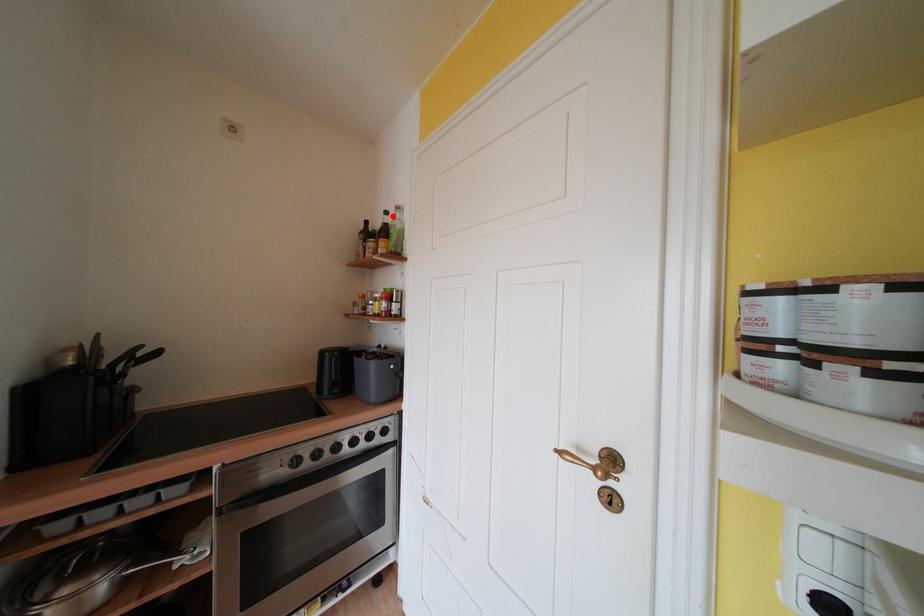
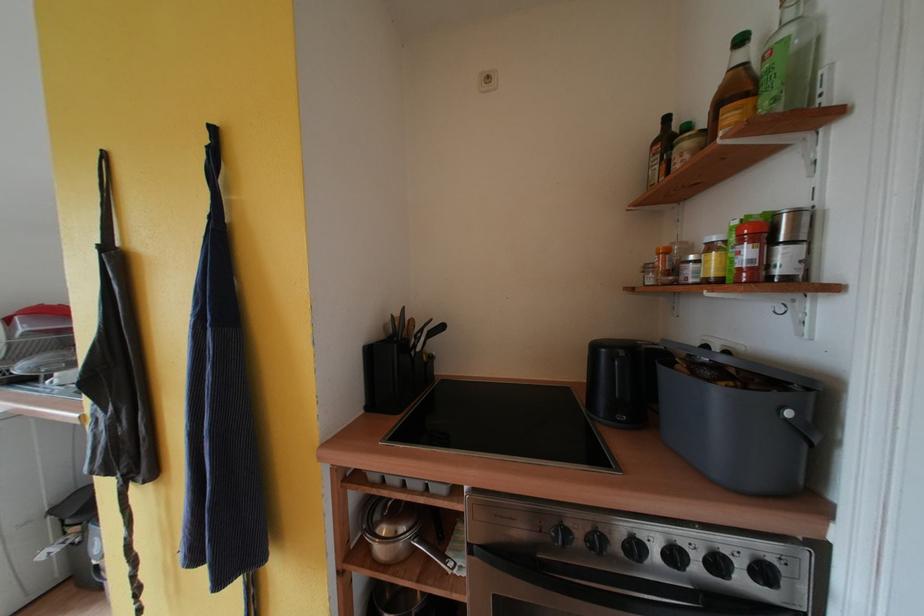
Where in the second image is the point corresponding to the highlighted location from the first image?

(748, 44)